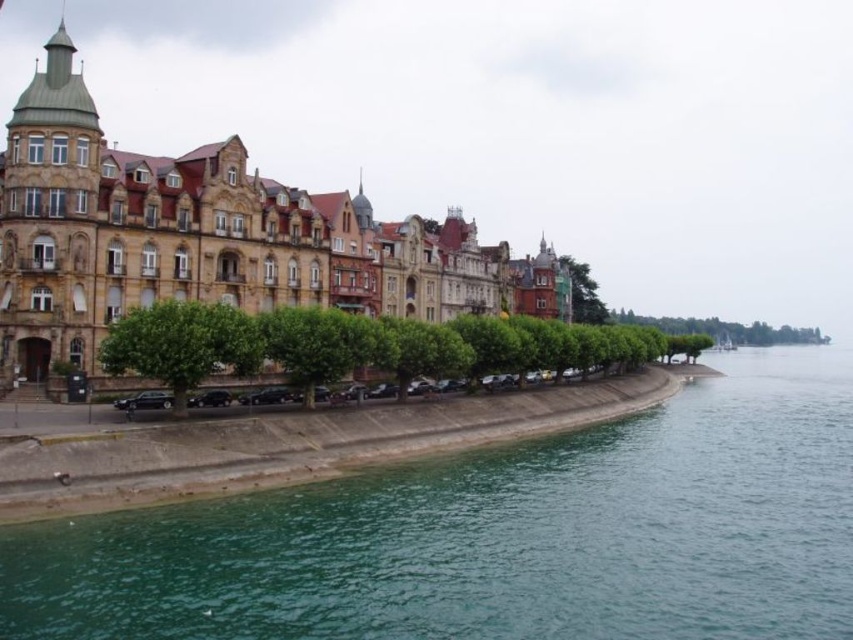
Question: From the image, what is the correct spatial relationship of green leafy tree at center in relation to green leafy trees at lower right?

Choices:
 (A) above
 (B) below

Answer: (B)

Question: Estimate the real-world distances between objects in this image. Which object is closer to the green leafy tree at center?

Choices:
 (A) green leafy trees at lower right
 (B) green leafy trees at center
 (C) green leafy tree at upper right
 (D) green water at lower left

Answer: (B)

Question: Estimate the real-world distances between objects in this image. Which object is farther from the green leafy tree at center?

Choices:
 (A) green leafy tree at upper right
 (B) green leafy trees at lower right

Answer: (B)

Question: Can you confirm if green water at lower left is positioned to the left of green leafy trees at center?

Choices:
 (A) no
 (B) yes

Answer: (A)

Question: Does green water at lower left appear on the right side of green leafy tree at upper right?

Choices:
 (A) no
 (B) yes

Answer: (A)

Question: Which point is closer to the camera taking this photo?

Choices:
 (A) (190, 304)
 (B) (592, 381)
 (C) (715, 616)

Answer: (C)